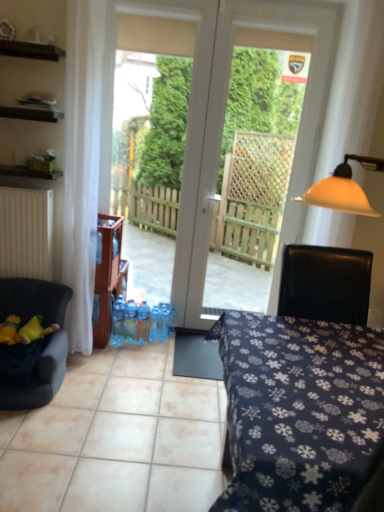
Question: Should I look upward or downward to see blue plastic bottle at center, the fourth bottle from the left?

Choices:
 (A) up
 (B) down

Answer: (B)

Question: Considering the relative sizes of dark blue fabric table at center and velvet dark blue chair at left in the image provided, is dark blue fabric table at center smaller than velvet dark blue chair at left?

Choices:
 (A) no
 (B) yes

Answer: (A)

Question: From the image's perspective, would you say dark blue fabric table at center is shown under velvet dark blue chair at left?

Choices:
 (A) yes
 (B) no

Answer: (A)

Question: From the image's perspective, is dark blue fabric table at center on top of velvet dark blue chair at left?

Choices:
 (A) no
 (B) yes

Answer: (A)

Question: Considering the relative positions of dark blue fabric table at center and velvet dark blue chair at left in the image provided, is dark blue fabric table at center in front of velvet dark blue chair at left?

Choices:
 (A) no
 (B) yes

Answer: (B)

Question: Does dark blue fabric table at center have a greater width compared to velvet dark blue chair at left?

Choices:
 (A) no
 (B) yes

Answer: (B)

Question: Is the position of dark blue fabric table at center more distant than that of velvet dark blue chair at left?

Choices:
 (A) no
 (B) yes

Answer: (A)

Question: From the image's perspective, is blue plastic bottle at center, the third bottle in the right-to-left sequence, beneath blue plastic bottle at center, the second bottle positioned from the left?

Choices:
 (A) no
 (B) yes

Answer: (B)

Question: Is blue plastic bottle at center, the third bottle in the right-to-left sequence, facing towards blue plastic bottle at center, the second bottle positioned from the left?

Choices:
 (A) yes
 (B) no

Answer: (B)

Question: Does blue plastic bottle at center, marked as the third bottle in a left-to-right arrangement, touch blue plastic bottle at center, the fourth bottle positioned from the right?

Choices:
 (A) no
 (B) yes

Answer: (B)

Question: From a real-world perspective, is blue plastic bottle at center, marked as the third bottle in a left-to-right arrangement, beneath blue plastic bottle at center, the fourth bottle positioned from the right?

Choices:
 (A) yes
 (B) no

Answer: (B)

Question: Is blue plastic bottle at center, the second bottle positioned from the left, at the back of blue plastic bottle at center, marked as the third bottle in a left-to-right arrangement?

Choices:
 (A) yes
 (B) no

Answer: (B)

Question: Is blue plastic bottle at center, marked as the third bottle in a left-to-right arrangement, at the left side of blue plastic bottle at center, the second bottle positioned from the left?

Choices:
 (A) no
 (B) yes

Answer: (A)

Question: Does dark blue fabric table at center have a greater height compared to blue plastic bottle at center, which is the 2th bottle from right to left?

Choices:
 (A) yes
 (B) no

Answer: (A)